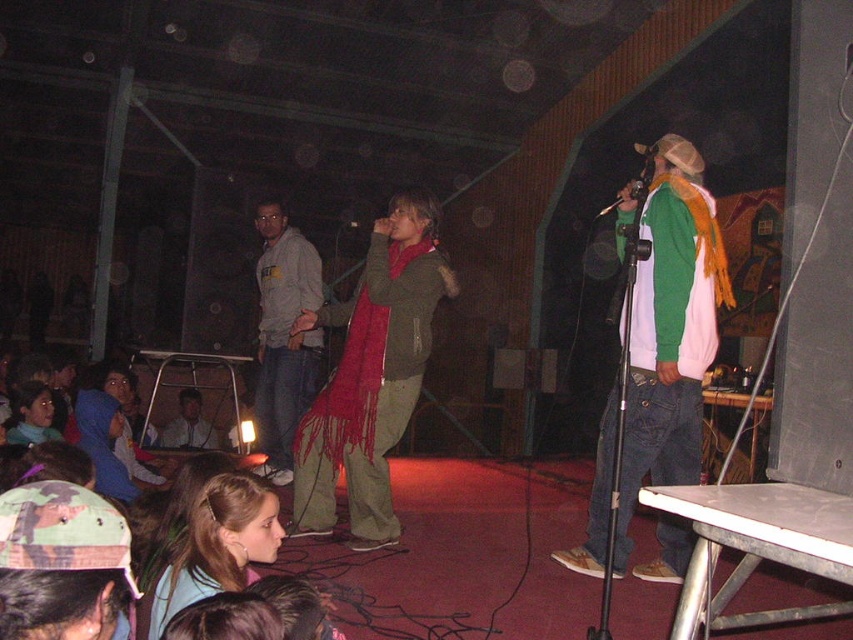
Question: Can you confirm if matte red scarf at center is thinner than matte gray hoodie at center?

Choices:
 (A) no
 (B) yes

Answer: (A)

Question: Considering the real-world distances, which object is closest to the metallic silver microphone at center?

Choices:
 (A) blonde hair at lower left
 (B) matte green jacket at lower left

Answer: (A)

Question: Which object appears closest to the camera in this image?

Choices:
 (A) blue denim jacket at lower left
 (B) matte green jacket at lower left
 (C) light brown leather jacket at center

Answer: (B)

Question: Is green fleece jacket at center above blue denim jacket at lower left?

Choices:
 (A) yes
 (B) no

Answer: (A)

Question: Which is farther from the light brown leather jacket at center?

Choices:
 (A) blonde hair at lower left
 (B) blue denim jacket at lower left

Answer: (A)

Question: Does green fleece jacket at center have a larger size compared to matte green jacket at lower left?

Choices:
 (A) yes
 (B) no

Answer: (A)